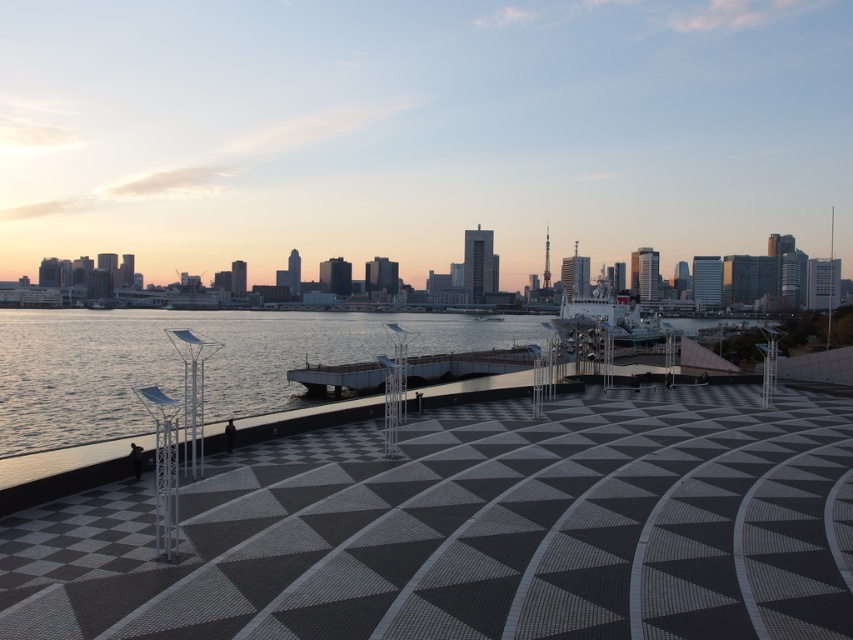
Is clear water at lower left bigger than shiny metallic ship at center?

Correct, clear water at lower left is larger in size than shiny metallic ship at center.

This screenshot has width=853, height=640. Identify the location of clear water at lower left. (206, 364).

Where is `clear water at lower left`? The width and height of the screenshot is (853, 640). clear water at lower left is located at coordinates (206, 364).